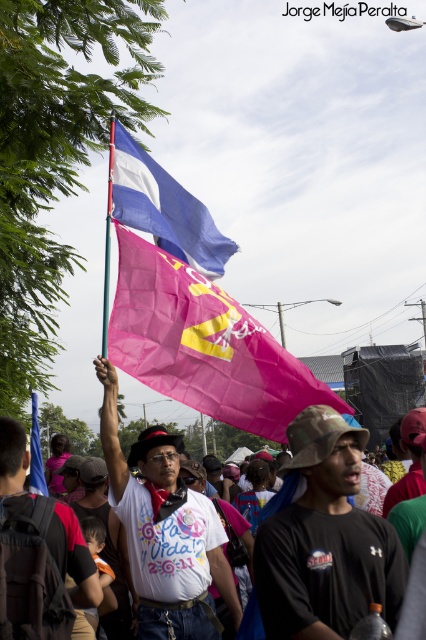
Consider the image. You are a photographer trying to capture the flag holder in the image. The flag holder is at point [325,540]. You need to adjust your camera to focus on the black matte shirt at center. Is the flag holder within the area of the black matte shirt at center?

Yes, the point [325,540] where the flag holder is located is on the black matte shirt at center, so the flag holder is within the area of the black matte shirt at center.